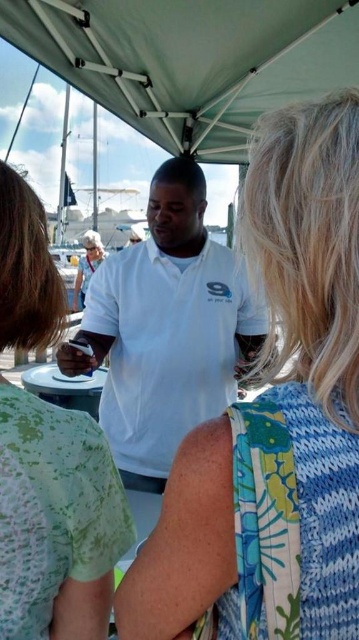
From the picture: You are organizing a clothing display and need to arrange the floral fabric dress at center and the green textured blouse at center based on their sizes. Which one should you place first if you want to start with the larger item?

The floral fabric dress at center has a larger size compared to the green textured blouse at center, so you should place the floral fabric dress at center first.

You are a photographer positioned behind the three people under the white canopy tent. You need to capture a photo where both the floral fabric dress at center and the green textured blouse at center are fully visible. Based on their heights, which clothing item might require adjustment to ensure it doesn not block the other?

The floral fabric dress at center is not as tall as the green textured blouse at center, so the shorter floral fabric dress at center might need to be moved forward or raised to avoid being blocked by the taller green textured blouse at center.

You are standing under the white canopy tent at the marina and see both the green textured blouse at center and the white matte shirt at center. Which one is positioned to the left?

The green textured blouse at center is positioned to the left of the white matte shirt at center.